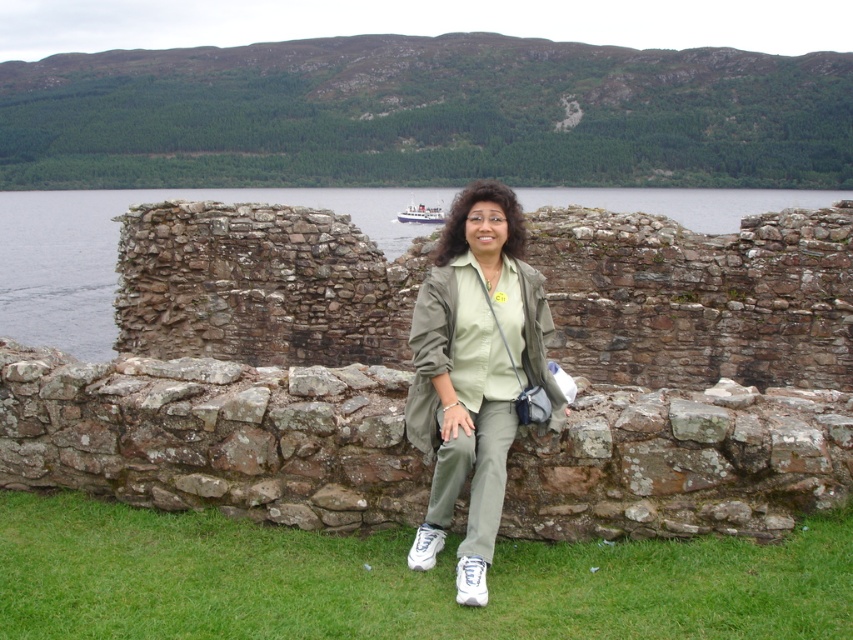
Who is lower down, clear water at center or brushed metal boat at upper center?

Positioned lower is brushed metal boat at upper center.

Does clear water at center come behind brushed metal boat at upper center?

No, clear water at center is in front of brushed metal boat at upper center.

Does point (61, 250) come farther from viewer compared to point (428, 214)?

No, it is in front of (428, 214).

The width and height of the screenshot is (853, 640). I want to click on clear water at center, so click(x=115, y=248).

What do you see at coordinates (397, 580) in the screenshot? I see `green grass at lower center` at bounding box center [397, 580].

Find the location of `green grass at lower center`. green grass at lower center is located at coordinates (397, 580).

Between green grass at lower center and brushed metal boat at upper center, which one appears on the left side from the viewer's perspective?

Positioned to the left is brushed metal boat at upper center.

Is point (723, 570) positioned in front of point (404, 212)?

Yes, point (723, 570) is closer to viewer.

This screenshot has height=640, width=853. Identify the location of green grass at lower center. (397, 580).

This screenshot has height=640, width=853. I want to click on green grass at lower center, so click(x=397, y=580).